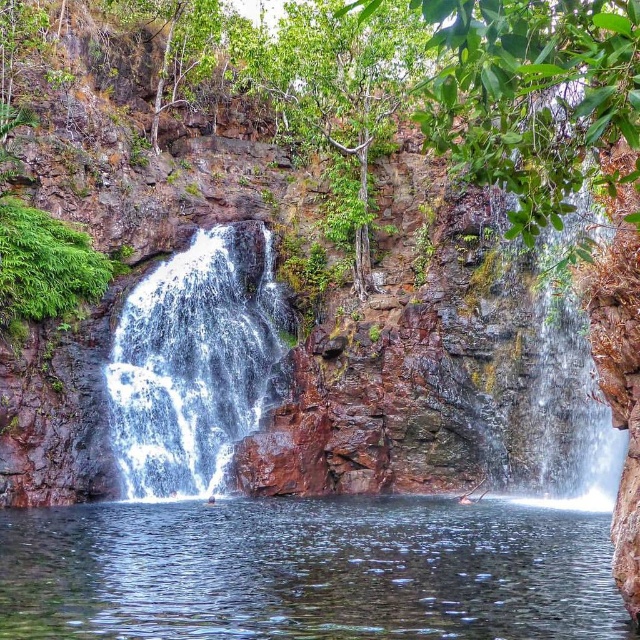
Find the location of a particular element. The width and height of the screenshot is (640, 640). clear water at center is located at coordinates (308, 570).

Between clear water at center and white frothy water at center left, which one appears on the left side from the viewer's perspective?

From the viewer's perspective, white frothy water at center left appears more on the left side.

Which is behind, point (582, 580) or point (182, 387)?

The point (182, 387) is more distant.

Image resolution: width=640 pixels, height=640 pixels. Identify the location of clear water at center. [308, 570].